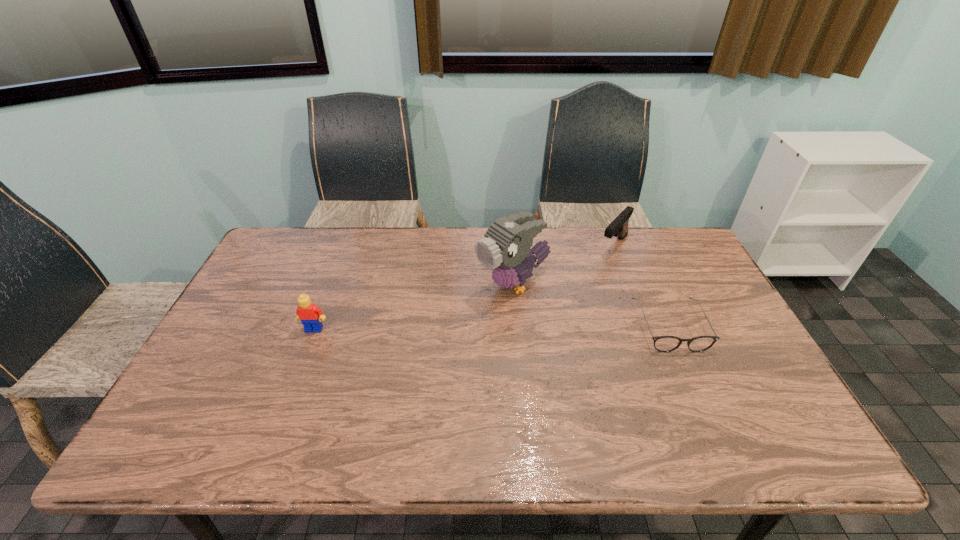
Where is `free space on the desktop that is between the Lego and the shortest object and is positioned on the front-facing side of the pistol`? This screenshot has width=960, height=540. free space on the desktop that is between the Lego and the shortest object and is positioned on the front-facing side of the pistol is located at coordinates (540, 327).

Locate an element on the screen. free space on the desktop that is between the leftmost object and the spectacles and is positioned at the beak of the bird is located at coordinates (439, 328).